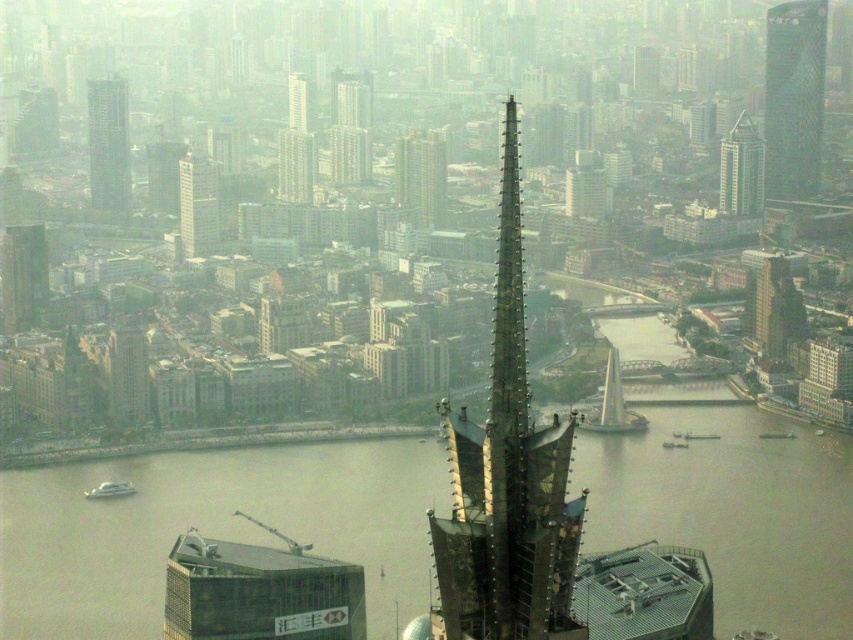
You are a drone operator trying to capture a clear photo of the matte gray building at center. However, the metallic glass building at lower left is blocking your view. Can you adjust your position to avoid the obstruction?

The metallic glass building at lower left is in front of the matte gray building at center, so you need to move your drone to a position where the matte gray building at center is no longer behind the metallic glass building at lower left. This could involve positioning the drone to the side or above both buildings to ensure an unobstructed view.

You are observing the cityscape from above and want to determine which of the two points, point (252, 596) or point (299, 157), is nearer to your vantage point. Based on the scene, which point is closer?

Point (252, 596) is closer to the camera than point (299, 157).